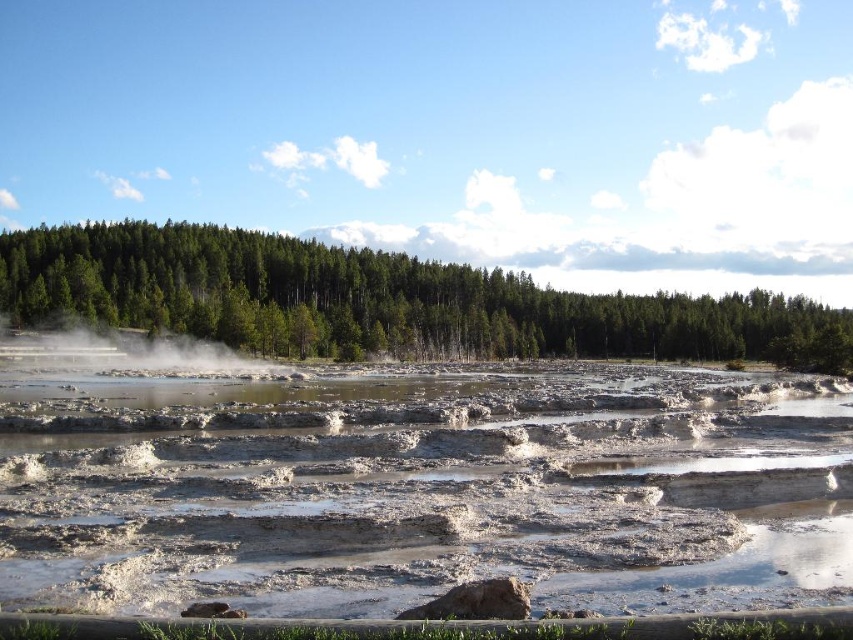
This screenshot has height=640, width=853. What do you see at coordinates (381, 301) in the screenshot?
I see `green matte forest at center` at bounding box center [381, 301].

Between point (753, 317) and point (73, 358), which one is positioned in front?

Point (73, 358) is in front.

Image resolution: width=853 pixels, height=640 pixels. What are the coordinates of `green matte forest at center` in the screenshot? It's located at (381, 301).

Which is in front, point (816, 435) or point (1, 284)?

Positioned in front is point (816, 435).

Can you confirm if muddy water at center is positioned to the right of green matte forest at center?

In fact, muddy water at center is to the left of green matte forest at center.

The image size is (853, 640). Identify the location of muddy water at center. (422, 486).

Does muddy water at center appear on the left side of white misty steam at center?

In fact, muddy water at center is to the right of white misty steam at center.

Does muddy water at center have a greater height compared to white misty steam at center?

No, muddy water at center is not taller than white misty steam at center.

In order to click on muddy water at center in this screenshot , I will do `click(422, 486)`.